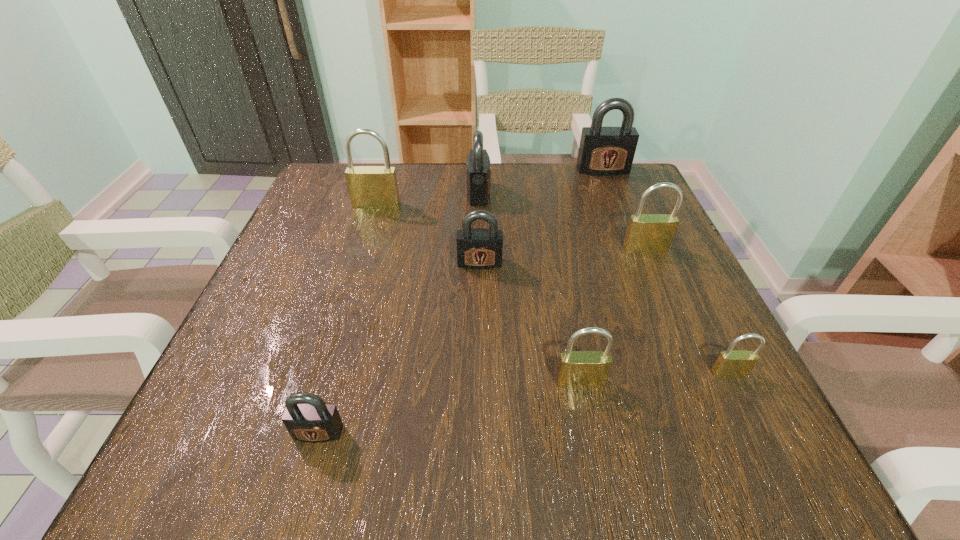
Image resolution: width=960 pixels, height=540 pixels. Find the location of `the farthest gray padlock`. the farthest gray padlock is located at coordinates (604, 151).

This screenshot has width=960, height=540. I want to click on the biggest gray padlock, so click(604, 151).

Where is `the leftmost brass padlock`? the leftmost brass padlock is located at coordinates pyautogui.click(x=370, y=187).

Where is `the farthest brass padlock`? the farthest brass padlock is located at coordinates (370, 187).

Locate an element on the screen. the second farthest gray padlock is located at coordinates (478, 169).

I want to click on the fifth nearest object, so click(646, 233).

The image size is (960, 540). I want to click on the fifth nearest padlock, so click(646, 233).

Identify the location of the second nearest gray padlock. The width and height of the screenshot is (960, 540). pyautogui.click(x=479, y=248).

This screenshot has width=960, height=540. I want to click on the fifth farthest padlock, so click(479, 248).

The width and height of the screenshot is (960, 540). In order to click on the fifth padlock from left to right in this screenshot , I will do `click(577, 369)`.